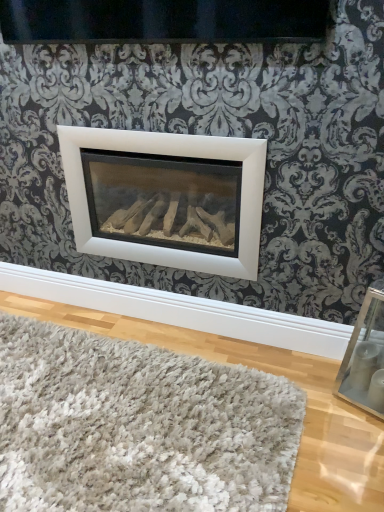
Question: Should I look upward or downward to see white shaggy rug at lower center?

Choices:
 (A) down
 (B) up

Answer: (A)

Question: From the image's perspective, is white shaggy rug at lower center located above white matte fireplace at center?

Choices:
 (A) no
 (B) yes

Answer: (A)

Question: Does white shaggy rug at lower center appear on the right side of white matte fireplace at center?

Choices:
 (A) no
 (B) yes

Answer: (A)

Question: Can you confirm if white shaggy rug at lower center is wider than white matte fireplace at center?

Choices:
 (A) no
 (B) yes

Answer: (B)

Question: Considering the relative sizes of white shaggy rug at lower center and white matte fireplace at center in the image provided, is white shaggy rug at lower center smaller than white matte fireplace at center?

Choices:
 (A) no
 (B) yes

Answer: (B)

Question: Is white shaggy rug at lower center positioned far away from white matte fireplace at center?

Choices:
 (A) no
 (B) yes

Answer: (A)

Question: Is white shaggy rug at lower center to the left of white matte fireplace at center from the viewer's perspective?

Choices:
 (A) no
 (B) yes

Answer: (B)

Question: Is clear glass picture frame at lower right oriented towards white matte fireplace at center?

Choices:
 (A) yes
 (B) no

Answer: (B)

Question: Can you confirm if clear glass picture frame at lower right is thinner than white matte fireplace at center?

Choices:
 (A) no
 (B) yes

Answer: (B)

Question: Can you confirm if clear glass picture frame at lower right is smaller than white matte fireplace at center?

Choices:
 (A) yes
 (B) no

Answer: (A)

Question: Is white matte fireplace at center completely or partially inside clear glass picture frame at lower right?

Choices:
 (A) no
 (B) yes

Answer: (A)

Question: Is clear glass picture frame at lower right in contact with white matte fireplace at center?

Choices:
 (A) yes
 (B) no

Answer: (B)

Question: Is clear glass picture frame at lower right to the left of white matte fireplace at center from the viewer's perspective?

Choices:
 (A) yes
 (B) no

Answer: (B)

Question: Does white matte fireplace at center have a smaller size compared to white shaggy rug at lower center?

Choices:
 (A) no
 (B) yes

Answer: (A)